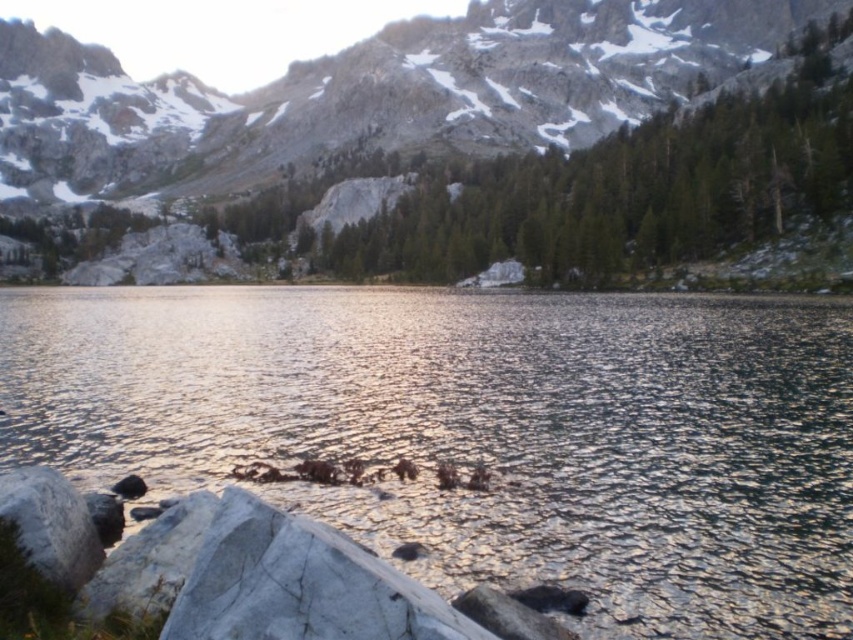
Question: Can you confirm if glistening water at center is positioned above gray rocky mountain at upper center?

Choices:
 (A) no
 (B) yes

Answer: (A)

Question: Which object is farther from the camera taking this photo?

Choices:
 (A) gray rocky mountain at upper center
 (B) glistening water at center

Answer: (A)

Question: Is glistening water at center to the right of gray rocky mountain at upper center from the viewer's perspective?

Choices:
 (A) yes
 (B) no

Answer: (A)

Question: Which point is farther to the camera?

Choices:
 (A) gray rocky mountain at upper center
 (B) glistening water at center

Answer: (A)

Question: Is glistening water at center closer to camera compared to gray rocky mountain at upper center?

Choices:
 (A) no
 (B) yes

Answer: (B)